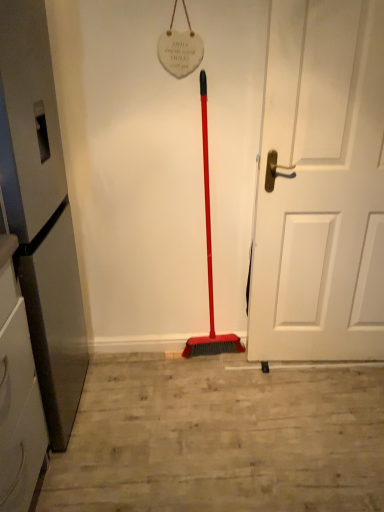
Locate an element on the screen. This screenshot has height=512, width=384. free space in front of white matte door at center is located at coordinates (321, 416).